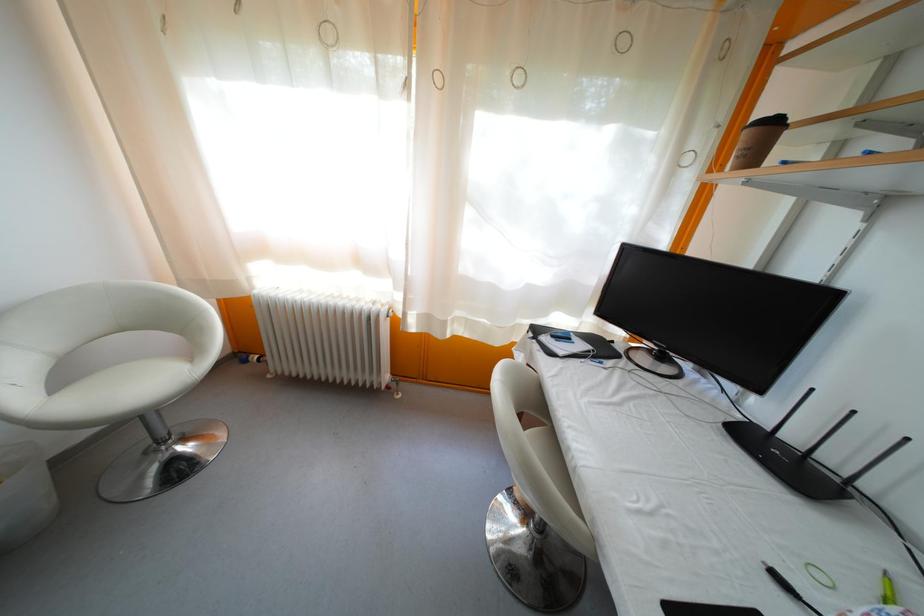
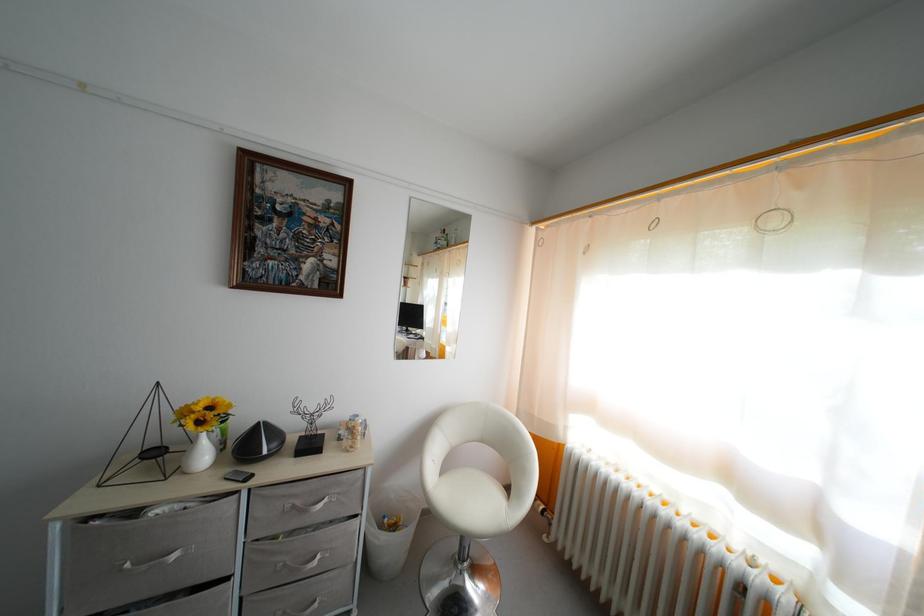
Question: The first image is from the beginning of the video and the second image is from the end. How did the camera likely rotate when shooting the video?

Choices:
 (A) Left
 (B) Right
 (C) Up
 (D) Down

Answer: (A)